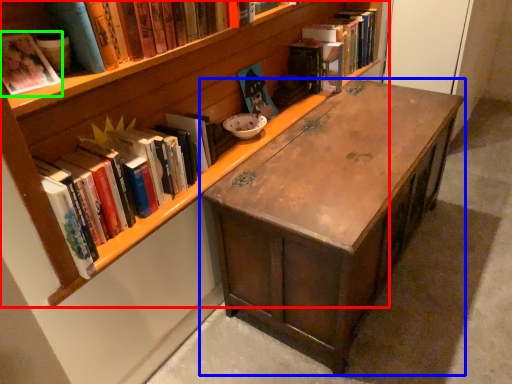
Question: Considering the real-world distances, which object is closest to bookcase (highlighted by a red box)? desk (highlighted by a blue box) or book (highlighted by a green box).

Choices:
 (A) desk
 (B) book

Answer: (A)